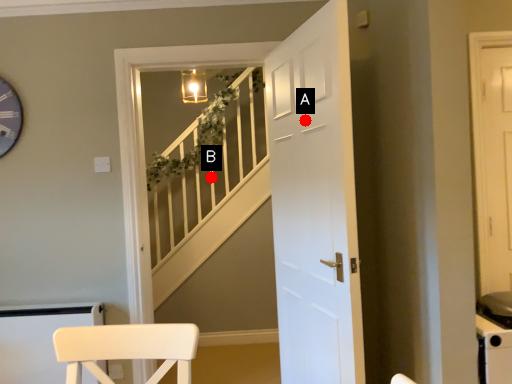
Question: Two points are circled on the image, labeled by A and B beside each circle. Which point is farther from the camera taking this photo?

Choices:
 (A) A is further
 (B) B is further

Answer: (B)